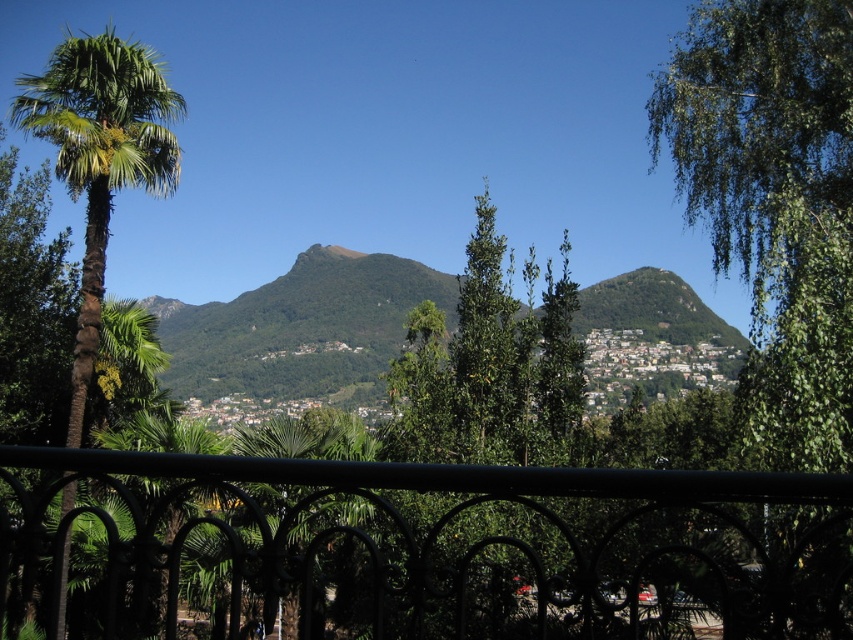
Is green leafy tree at upper right thinner than green leafy palm tree at left?

Indeed, green leafy tree at upper right has a lesser width compared to green leafy palm tree at left.

Is point (752, 442) closer to viewer compared to point (115, 97)?

Yes, it is.

The height and width of the screenshot is (640, 853). Describe the element at coordinates (775, 204) in the screenshot. I see `green leafy tree at upper right` at that location.

At what (x,y) coordinates should I click in order to perform the action: click on green leafy tree at upper right. Please return your answer as a coordinate pair (x, y). The image size is (853, 640). Looking at the image, I should click on (775, 204).

Between black wrought iron fence at center and green leafy tree at upper right, which one is positioned lower?

black wrought iron fence at center

Can you confirm if black wrought iron fence at center is smaller than green leafy tree at upper right?

Yes.

Is point (563, 560) more distant than point (801, 60)?

No, (563, 560) is in front of (801, 60).

Where is `black wrought iron fence at center`? The height and width of the screenshot is (640, 853). black wrought iron fence at center is located at coordinates (421, 548).

Does black wrought iron fence at center have a larger size compared to green leafy palm tree at left?

No, black wrought iron fence at center is not bigger than green leafy palm tree at left.

In order to click on black wrought iron fence at center in this screenshot , I will do `click(421, 548)`.